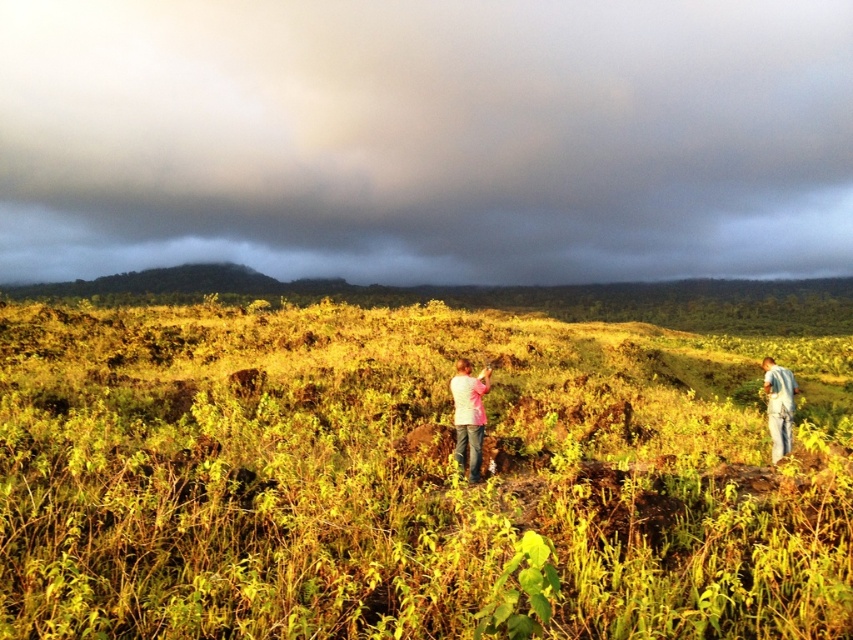
Question: Does dark gray cloud at upper center have a greater width compared to blue jeans at lower right?

Choices:
 (A) no
 (B) yes

Answer: (B)

Question: Which point is closer to the camera?

Choices:
 (A) blue jeans at lower right
 (B) dark gray cloud at upper center
 (C) pink fabric at center

Answer: (C)

Question: Which point is farther to the camera?

Choices:
 (A) pink fabric at center
 (B) blue jeans at lower right

Answer: (B)

Question: Is pink fabric at center below blue jeans at lower right?

Choices:
 (A) yes
 (B) no

Answer: (A)

Question: Is pink fabric at center smaller than blue jeans at lower right?

Choices:
 (A) no
 (B) yes

Answer: (A)

Question: Among these points, which one is farthest from the camera?

Choices:
 (A) (776, 452)
 (B) (47, 116)
 (C) (474, 412)

Answer: (B)